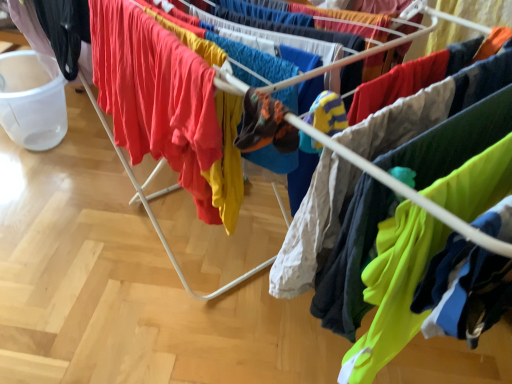
Question: Does matte red t-shirt at center, which ranks as the second clothing in right-to-left order, have a greater width compared to black matte pants at left, which is counted as the first clothing, starting from the left?

Choices:
 (A) yes
 (B) no

Answer: (A)

Question: Considering the relative sizes of matte red t-shirt at center, which ranks as the second clothing in right-to-left order, and black matte pants at left, which is counted as the first clothing, starting from the left, in the image provided, is matte red t-shirt at center, which ranks as the second clothing in right-to-left order, taller than black matte pants at left, which is counted as the first clothing, starting from the left,?

Choices:
 (A) yes
 (B) no

Answer: (A)

Question: Are matte red t-shirt at center, which appears as the 2th clothing when viewed from the left, and black matte pants at left, which is counted as the first clothing, starting from the left, far apart?

Choices:
 (A) no
 (B) yes

Answer: (A)

Question: Considering the relative sizes of matte red t-shirt at center, which appears as the 2th clothing when viewed from the left, and black matte pants at left, which is counted as the first clothing, starting from the left, in the image provided, is matte red t-shirt at center, which appears as the 2th clothing when viewed from the left, thinner than black matte pants at left, which is counted as the first clothing, starting from the left,?

Choices:
 (A) yes
 (B) no

Answer: (B)

Question: Does matte red t-shirt at center, which appears as the 2th clothing when viewed from the left, lie in front of black matte pants at left, which is counted as the first clothing, starting from the left?

Choices:
 (A) no
 (B) yes

Answer: (B)

Question: Considering the relative sizes of matte red t-shirt at center, which appears as the 2th clothing when viewed from the left, and black matte pants at left, which is counted as the first clothing, starting from the left, in the image provided, is matte red t-shirt at center, which appears as the 2th clothing when viewed from the left, smaller than black matte pants at left, which is counted as the first clothing, starting from the left,?

Choices:
 (A) yes
 (B) no

Answer: (B)

Question: Considering the relative sizes of neon green fabric at lower right, which is the 1th clothing in right-to-left order, and black matte pants at left, placed as the third clothing when sorted from right to left, in the image provided, is neon green fabric at lower right, which is the 1th clothing in right-to-left order, thinner than black matte pants at left, placed as the third clothing when sorted from right to left,?

Choices:
 (A) yes
 (B) no

Answer: (A)

Question: From a real-world perspective, does neon green fabric at lower right, which is the 1th clothing in right-to-left order, stand above black matte pants at left, placed as the third clothing when sorted from right to left?

Choices:
 (A) no
 (B) yes

Answer: (B)

Question: Is neon green fabric at lower right, which is the 1th clothing in right-to-left order, to the left of black matte pants at left, which is counted as the first clothing, starting from the left, from the viewer's perspective?

Choices:
 (A) yes
 (B) no

Answer: (B)

Question: Can you confirm if neon green fabric at lower right, the 3th clothing in the left-to-right sequence, is smaller than black matte pants at left, which is counted as the first clothing, starting from the left?

Choices:
 (A) yes
 (B) no

Answer: (A)

Question: Can you confirm if neon green fabric at lower right, which is the 1th clothing in right-to-left order, is bigger than black matte pants at left, placed as the third clothing when sorted from right to left?

Choices:
 (A) no
 (B) yes

Answer: (A)

Question: Are neon green fabric at lower right, which is the 1th clothing in right-to-left order, and black matte pants at left, which is counted as the first clothing, starting from the left, far apart?

Choices:
 (A) no
 (B) yes

Answer: (B)

Question: Can you see neon green fabric at lower right, which is the 1th clothing in right-to-left order, touching matte red t-shirt at center, which ranks as the second clothing in right-to-left order?

Choices:
 (A) yes
 (B) no

Answer: (B)